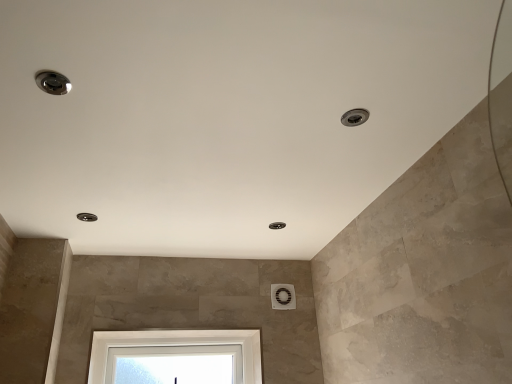
Question: From the image's perspective, is satin nickel droplight at upper right, which appears as the 3th droplight when viewed from the left, above or below matte silver droplight at upper left, the 1th droplight from the back?

Choices:
 (A) above
 (B) below

Answer: (A)

Question: From a real-world perspective, relative to matte silver droplight at upper left, the 1th droplight ordered from the bottom, is satin nickel droplight at upper right, the second droplight positioned from the top, vertically above or below?

Choices:
 (A) below
 (B) above

Answer: (B)

Question: Based on their relative distances, which object is nearer to the satin nickel droplight at upper left, the 2th droplight positioned from the right?

Choices:
 (A) matte silver droplight at upper left, positioned as the 1th droplight in left-to-right order
 (B) satin nickel droplight at upper right, which ranks as the second droplight in bottom-to-top order

Answer: (B)

Question: Estimate the real-world distances between objects in this image. Which object is farther from the satin nickel droplight at upper right, which appears as the 3th droplight when viewed from the left?

Choices:
 (A) matte silver droplight at upper left, positioned as the 1th droplight in left-to-right order
 (B) satin nickel droplight at upper left, the first droplight viewed from the front

Answer: (A)